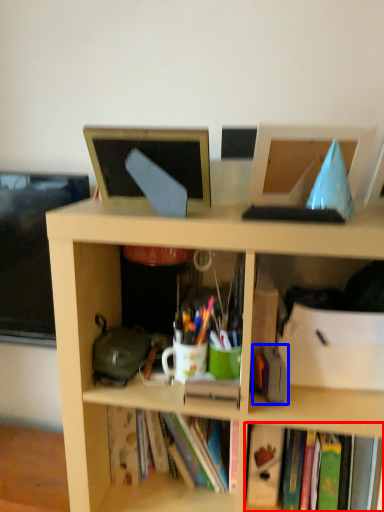
Question: Among these objects, which one is farthest to the camera, book (highlighted by a red box) or stationery (highlighted by a blue box)?

Choices:
 (A) book
 (B) stationery

Answer: (A)